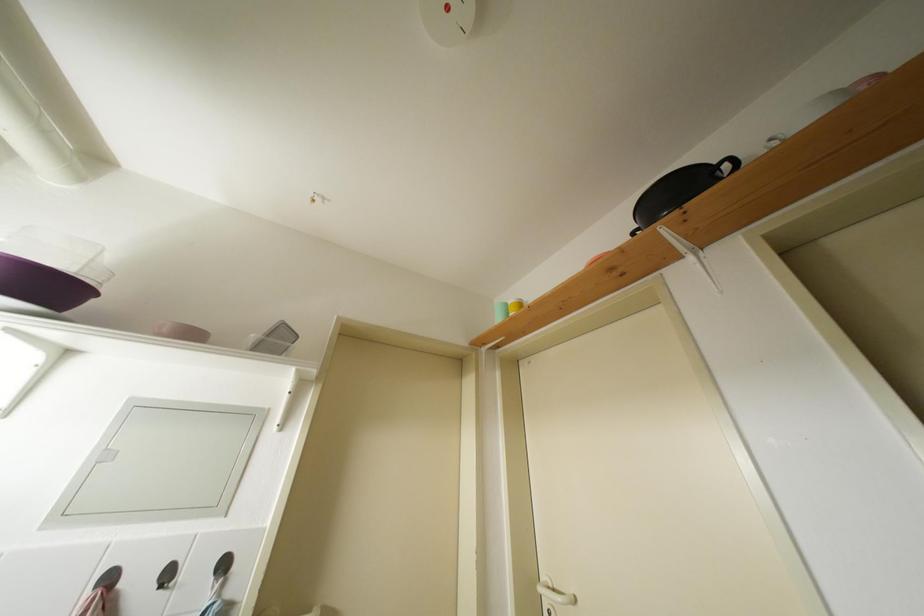
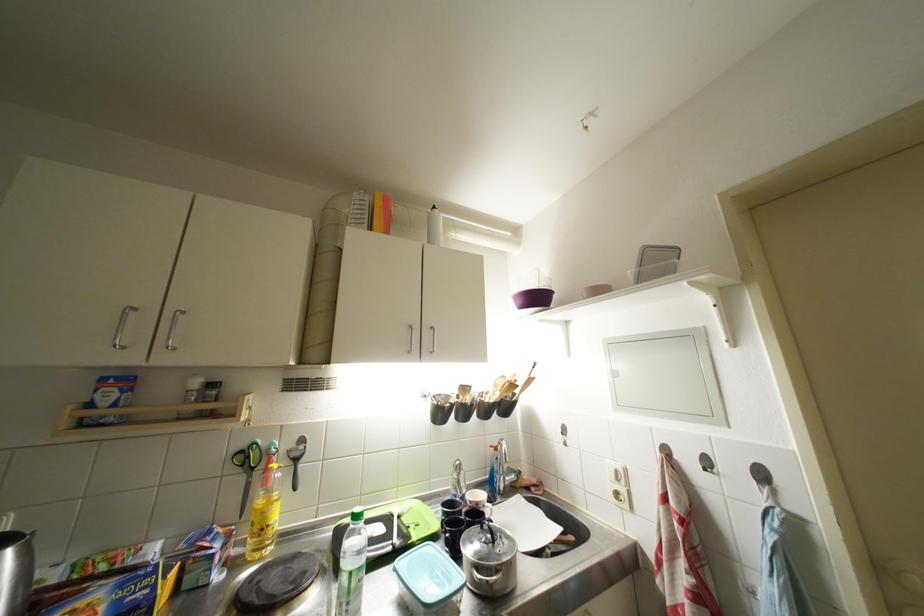
In the second image, find the point that corresponds to [231,570] in the first image.

(769, 479)